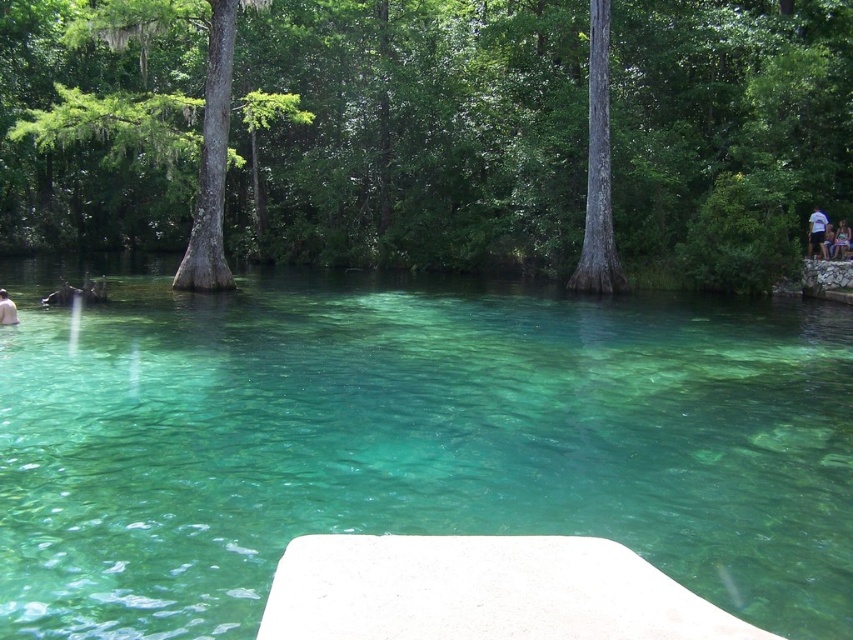
You are standing at the edge of the water and want to walk to the green leafy tree at center. Given that the coordinates are relative to the image, with the bottom left corner being the origin, can you determine the direction you should head in?

The green leafy tree at center is located at point (433, 132). Since the coordinates are relative to the image with the bottom left corner as the origin, the x coordinate 0.209 indicates a position to the right of the origin, and the y coordinate 0.509 indicates a position above the origin. Therefore, to reach the green leafy tree at center, you should head towards the upper right direction from your current position at the edge of the water.

You are a photographer trying to capture the white cotton shirt at upper right and the white matte person at lower left in the same frame. Can you see both subjects clearly without any obstruction?

The white cotton shirt at upper right is positioned over the white matte person at lower left, so the shirt may partially block the view of the person depending on the angle and distance. Adjust your position to ensure both are visible.

You are navigating a small boat in the serene natural setting. You see two points marked on your map as point 1 and point 2. Point 1 is at coordinates point (593, 35) and point 2 is at point (4, 301). If you are facing the direction of point 2, which point is located behind you?

Point (593, 35) is behind point (4, 301), so if you are facing the direction of point 2, point 1 would be behind you.